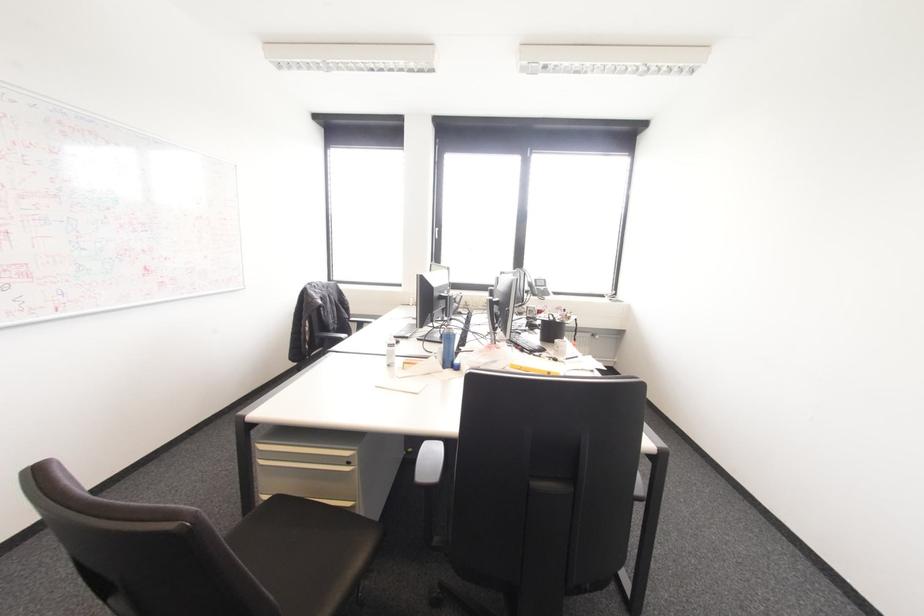
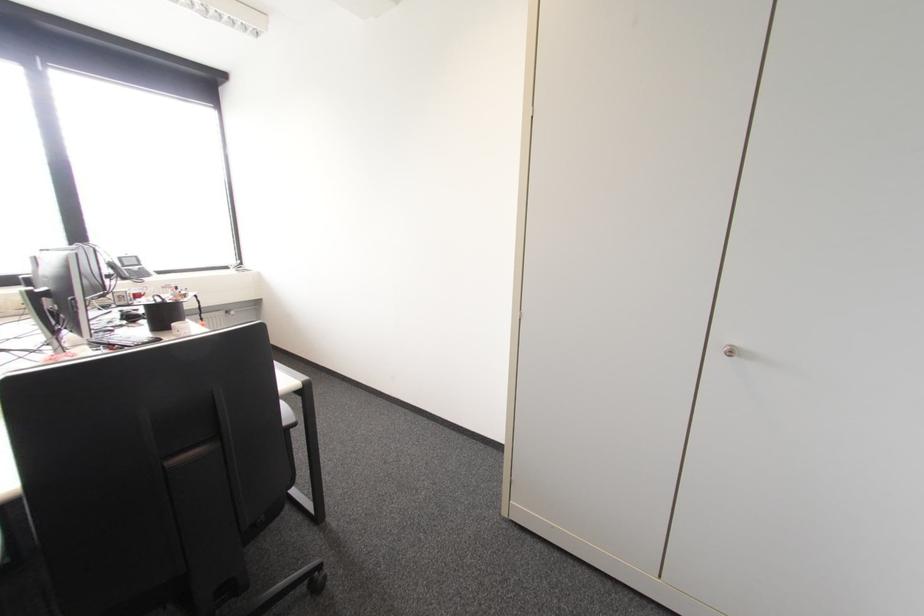
Question: The camera is either moving clockwise (left) or counter-clockwise (right) around the object. The first image is from the beginning of the video and the second image is from the end. Is the camera moving left or right when shooting the video?

Choices:
 (A) Left
 (B) Right

Answer: (A)